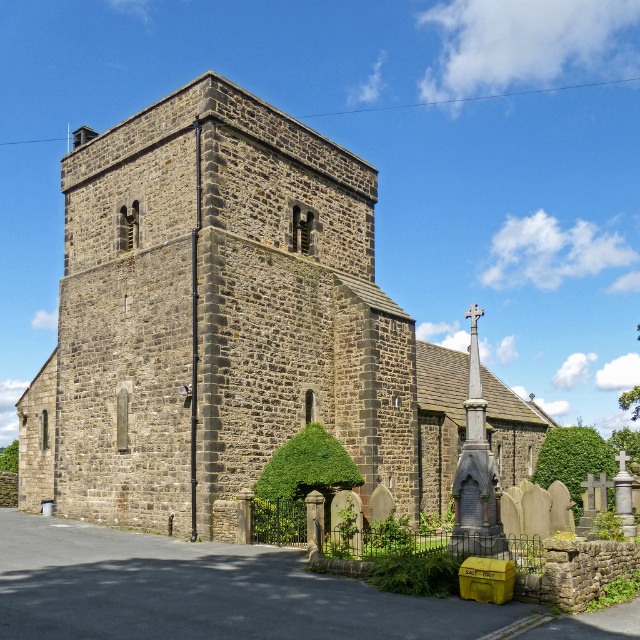
Does point (289, 515) lie behind point (580, 461)?

No, (289, 515) is closer to viewer.

Who is more distant from viewer, (269, 464) or (589, 442)?

Positioned behind is point (589, 442).

Between point (330, 445) and point (592, 429), which one is positioned behind?

The point (592, 429) is behind.

At what (x,y) coordinates should I click in order to perform the action: click on green leafy hedge at center. Please return your answer as a coordinate pair (x, y). Image resolution: width=640 pixels, height=640 pixels. Looking at the image, I should click on (300, 484).

Is rustic stone church at center thinner than green leafy hedge at lower right?

Indeed, rustic stone church at center has a lesser width compared to green leafy hedge at lower right.

Can you confirm if rustic stone church at center is bigger than green leafy hedge at lower right?

No.

At what (x,y) coordinates should I click in order to perform the action: click on rustic stone church at center. Please return your answer as a coordinate pair (x, y). Image resolution: width=640 pixels, height=640 pixels. Looking at the image, I should click on (225, 323).

Who is more forward, (349, 353) or (285, 499)?

Positioned in front is point (285, 499).

Can you confirm if rustic stone church at center is positioned to the left of green leafy hedge at center?

Incorrect, rustic stone church at center is not on the left side of green leafy hedge at center.

Find the location of a particular element. Image resolution: width=640 pixels, height=640 pixels. rustic stone church at center is located at coordinates (225, 323).

I want to click on rustic stone church at center, so click(x=225, y=323).